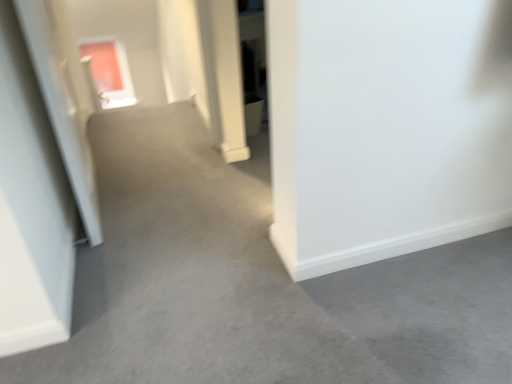
What do you see at coordinates (106, 71) in the screenshot? I see `transparent glass window at upper center` at bounding box center [106, 71].

Image resolution: width=512 pixels, height=384 pixels. I want to click on transparent glass window at upper center, so click(x=106, y=71).

At what (x,y) coordinates should I click in order to perform the action: click on transparent glass window at upper center. Please return your answer as a coordinate pair (x, y). The height and width of the screenshot is (384, 512). Looking at the image, I should click on (106, 71).